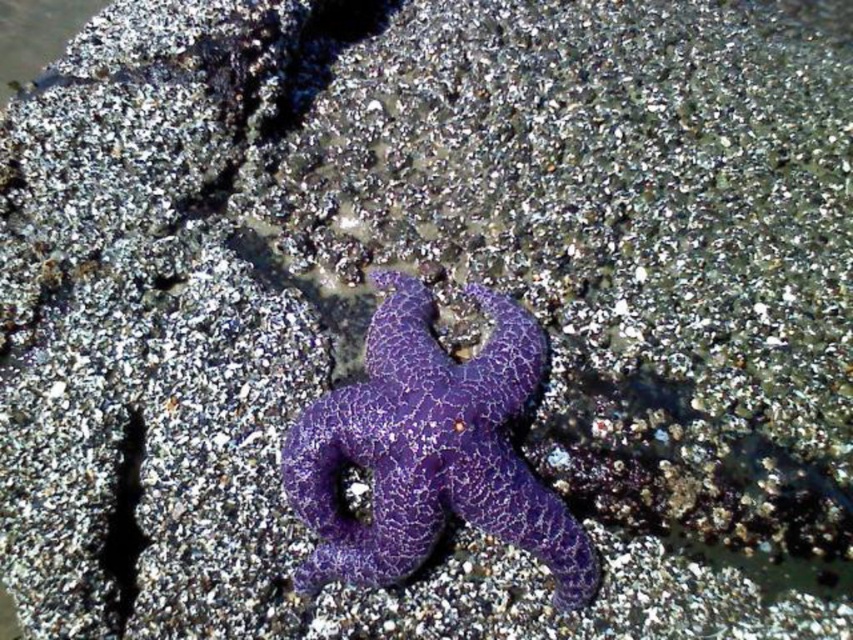
You are a marine biologist examining the image. You need to determine which object is taller between the purple cracked starfish at center and the clear water at upper left. Based on the scene, which one is taller?

The purple cracked starfish at center is taller than the clear water at upper left according to the description.

You are a marine biologist observing the scene. You need to determine which object takes up more space in the image. Which one is larger in size between the purple cracked starfish at center and the clear water at upper left?

The purple cracked starfish at center has a larger size compared to the clear water at upper left, so the purple cracked starfish at center takes up more space in the image.

You are a marine biologist examining the image. You need to determine which object is nearer to your viewpoint. Which is closer to you, the purple cracked starfish at center or the clear water at upper left?

The purple cracked starfish at center is closer to the viewer than the clear water at upper left.